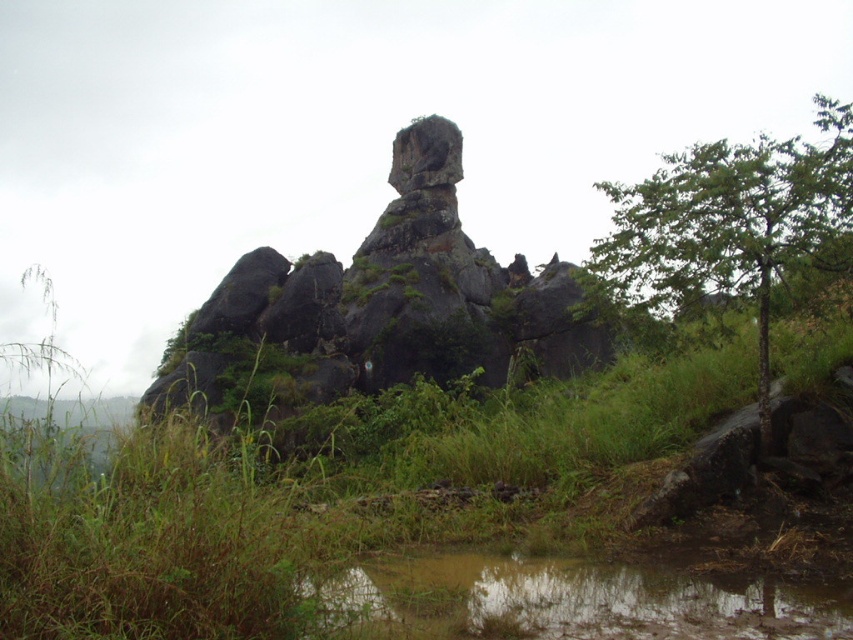
From the picture: Does rough granite rock at center have a greater height compared to green leafy tree at right?

No.

Based on the photo, between rough granite rock at center and green leafy tree at right, which one has more height?

green leafy tree at right

Is point (309, 392) closer to viewer compared to point (688, 148)?

Yes.

The width and height of the screenshot is (853, 640). Identify the location of rough granite rock at center. (381, 305).

Image resolution: width=853 pixels, height=640 pixels. What do you see at coordinates (415, 520) in the screenshot? I see `green grassy at center` at bounding box center [415, 520].

In the scene shown: Who is more distant from viewer, (440, 620) or (457, 230)?

Positioned behind is point (457, 230).

At what (x,y) coordinates should I click in order to perform the action: click on green grassy at center. Please return your answer as a coordinate pair (x, y). Looking at the image, I should click on (415, 520).

Who is taller, green leafy tree at right or muddy water at lower center?

green leafy tree at right is taller.

Can you confirm if green leafy tree at right is positioned to the left of muddy water at lower center?

In fact, green leafy tree at right is to the right of muddy water at lower center.

What do you see at coordinates (733, 225) in the screenshot? I see `green leafy tree at right` at bounding box center [733, 225].

Locate an element on the screen. green leafy tree at right is located at coordinates (733, 225).